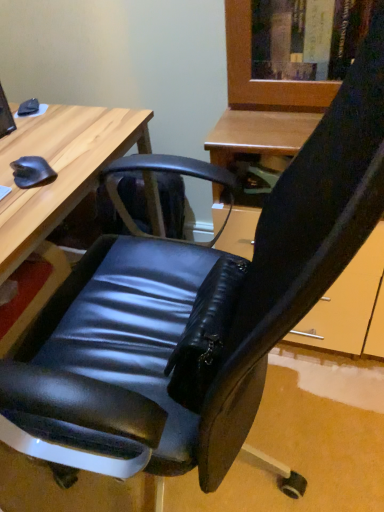
What is the approximate height of wooden desk at left?

27.37 inches.

This screenshot has height=512, width=384. I want to click on wooden desk at left, so click(x=58, y=184).

The width and height of the screenshot is (384, 512). What do you see at coordinates (58, 184) in the screenshot? I see `wooden desk at left` at bounding box center [58, 184].

Find the location of a particular element. The image size is (384, 512). matte black monitor at upper left is located at coordinates (5, 116).

What do you see at coordinates (5, 116) in the screenshot? I see `matte black monitor at upper left` at bounding box center [5, 116].

Locate an element on the screen. The height and width of the screenshot is (512, 384). wooden desk at left is located at coordinates (58, 184).

Which is more to the left, wooden desk at left or matte black monitor at upper left?

wooden desk at left.

Considering the positions of objects wooden desk at left and matte black monitor at upper left in the image provided, who is in front, wooden desk at left or matte black monitor at upper left?

wooden desk at left is more forward.

Is point (14, 195) in front of point (2, 111)?

Yes.

From the image's perspective, relative to matte black monitor at upper left, is wooden desk at left above or below?

From the image's perspective, wooden desk at left appears below matte black monitor at upper left.

From a real-world perspective, is wooden desk at left located beneath matte black monitor at upper left?

Yes, from a real-world perspective, wooden desk at left is under matte black monitor at upper left.

Considering the sizes of objects wooden desk at left and matte black monitor at upper left in the image provided, who is thinner, wooden desk at left or matte black monitor at upper left?

Thinner between the two is matte black monitor at upper left.

In terms of height, does wooden desk at left look taller or shorter compared to matte black monitor at upper left?

wooden desk at left is taller than matte black monitor at upper left.

In the scene shown: Considering the sizes of wooden desk at left and matte black monitor at upper left in the image, is wooden desk at left bigger or smaller than matte black monitor at upper left?

Clearly, wooden desk at left is larger in size than matte black monitor at upper left.

Can we say wooden desk at left lies outside matte black monitor at upper left?

Indeed, wooden desk at left is completely outside matte black monitor at upper left.

Is wooden desk at left in contact with matte black monitor at upper left?

No, wooden desk at left is not in contact with matte black monitor at upper left.

Is wooden desk at left positioned with its back to matte black monitor at upper left?

No, wooden desk at left is not facing away from matte black monitor at upper left.

How many degrees apart are the facing directions of wooden desk at left and matte black monitor at upper left?

They differ by 7.53 degrees in their facing directions.

Where is `desk on the left side of matte black monitor at upper left`? desk on the left side of matte black monitor at upper left is located at coordinates (58, 184).

Considering the positions of objects matte black monitor at upper left and wooden desk at left in the image provided, who is more to the right, matte black monitor at upper left or wooden desk at left?

Positioned to the right is matte black monitor at upper left.

Considering the positions of objects matte black monitor at upper left and wooden desk at left in the image provided, who is behind, matte black monitor at upper left or wooden desk at left?

matte black monitor at upper left is behind.

Does point (14, 126) lie behind point (26, 130)?

Yes, point (14, 126) is behind point (26, 130).

From the image's perspective, which is above, matte black monitor at upper left or wooden desk at left?

matte black monitor at upper left, from the image's perspective.

From a real-world perspective, between matte black monitor at upper left and wooden desk at left, who is vertically higher?

matte black monitor at upper left, from a real-world perspective.

Consider the image. Considering the sizes of objects matte black monitor at upper left and wooden desk at left in the image provided, who is wider, matte black monitor at upper left or wooden desk at left?

Wider between the two is wooden desk at left.

Considering the relative sizes of matte black monitor at upper left and wooden desk at left in the image provided, is matte black monitor at upper left shorter than wooden desk at left?

Indeed, matte black monitor at upper left has a lesser height compared to wooden desk at left.

Considering the sizes of matte black monitor at upper left and wooden desk at left in the image, is matte black monitor at upper left bigger or smaller than wooden desk at left?

In the image, matte black monitor at upper left appears to be smaller than wooden desk at left.

Is matte black monitor at upper left outside of wooden desk at left?

Yes, matte black monitor at upper left is located beyond the bounds of wooden desk at left.

Can you see matte black monitor at upper left touching wooden desk at left?

No, matte black monitor at upper left is not in contact with wooden desk at left.

Is matte black monitor at upper left turned away from wooden desk at left?

That's not correct — matte black monitor at upper left is not looking away from wooden desk at left.

How many degrees apart are the facing directions of matte black monitor at upper left and wooden desk at left?

matte black monitor at upper left and wooden desk at left are facing 7.53 degrees away from each other.

Where is `desk that appears in front of the matte black monitor at upper left`? This screenshot has width=384, height=512. desk that appears in front of the matte black monitor at upper left is located at coordinates (58, 184).

In order to click on computer monitor lying above the wooden desk at left (from the image's perspective) in this screenshot , I will do `click(5, 116)`.

I want to click on desk below the matte black monitor at upper left (from the image's perspective), so click(58, 184).